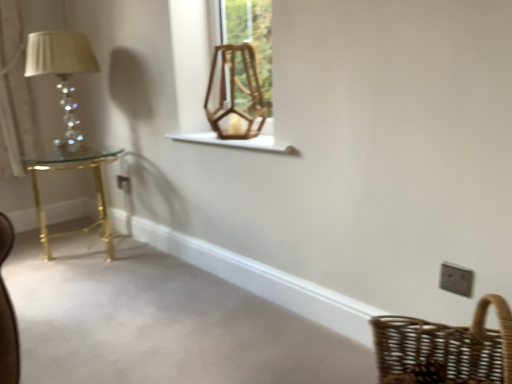
Question: Visually, is matte glass table lamp at left positioned to the left or to the right of white wooden window sill at center?

Choices:
 (A) right
 (B) left

Answer: (B)

Question: Is matte glass table lamp at left taller or shorter than white wooden window sill at center?

Choices:
 (A) tall
 (B) short

Answer: (A)

Question: Estimate the real-world distances between objects in this image. Which object is farther from the gold metallic table at left?

Choices:
 (A) white wooden window sill at center
 (B) matte glass table lamp at left
 (C) white plastic/light switch at lower right
 (D) wooden swivel chair at upper center
 (E) woven brown basket at lower right

Answer: (C)

Question: Estimate the real-world distances between objects in this image. Which object is farther from the white plastic/light switch at lower right?

Choices:
 (A) wooden swivel chair at upper center
 (B) white wooden window sill at center
 (C) gold metallic table at left
 (D) woven brown basket at lower right
 (E) matte glass table lamp at left

Answer: (C)